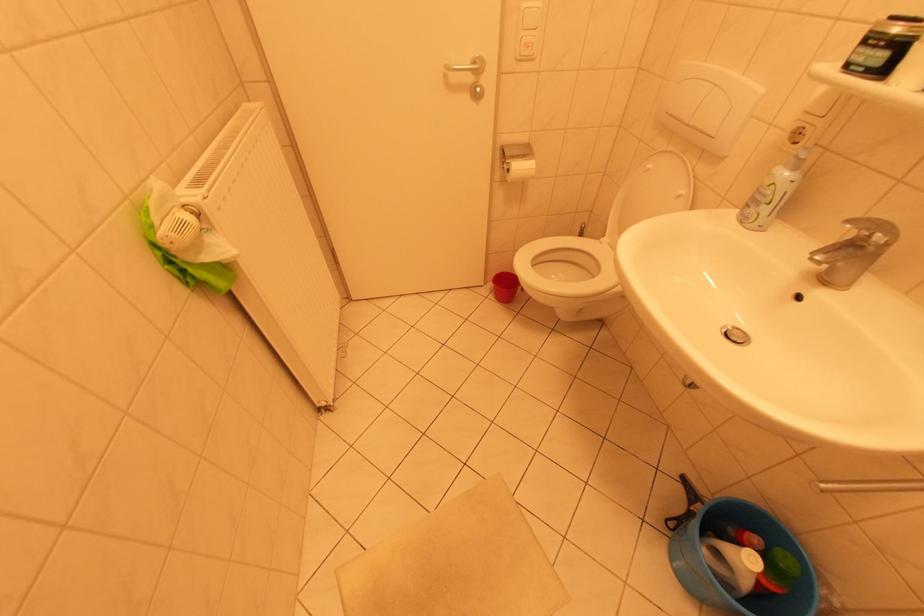
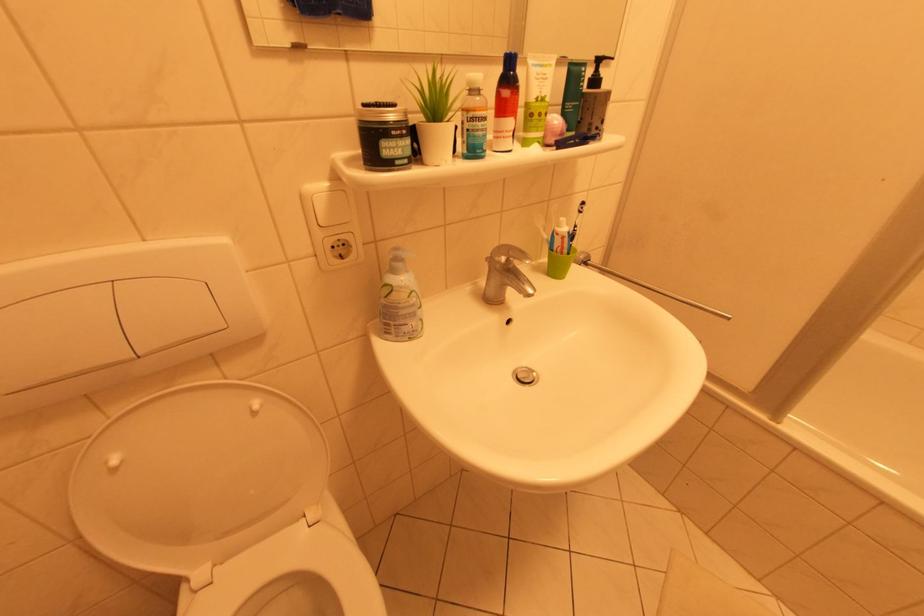
The first image is from the beginning of the video and the second image is from the end. How did the camera likely rotate when shooting the video?

The camera's rotation is toward right-down.